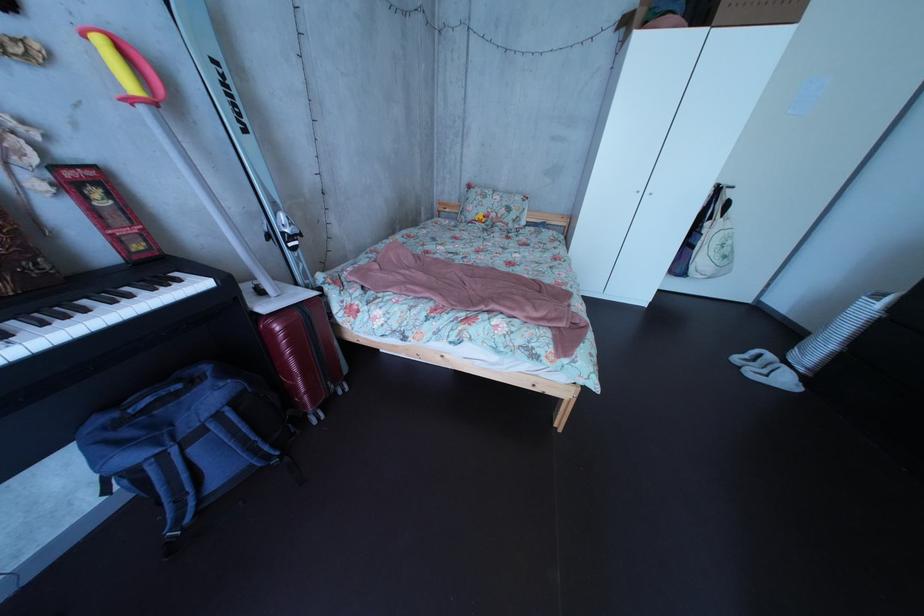
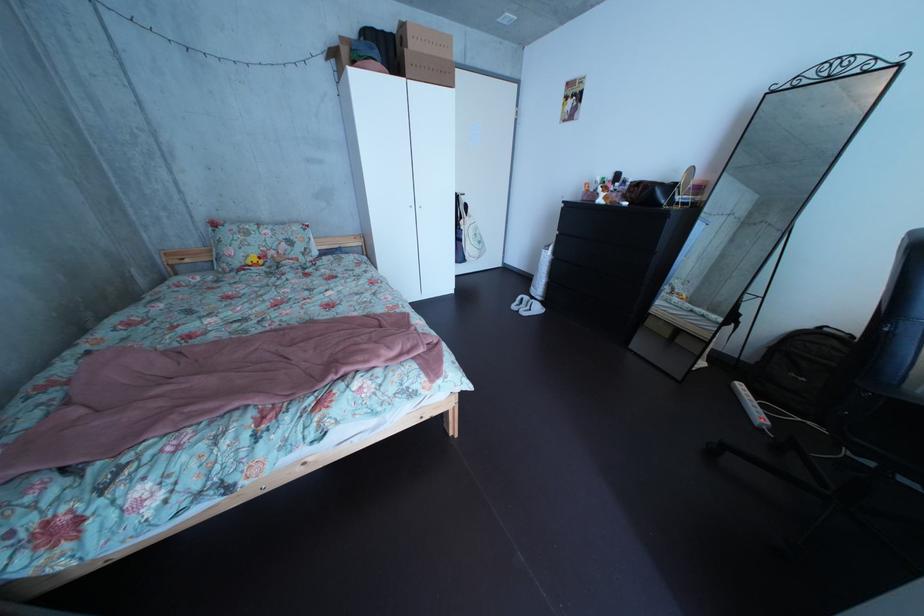
In the second image, find the point that corresponds to pixel 784 363 in the first image.

(541, 306)